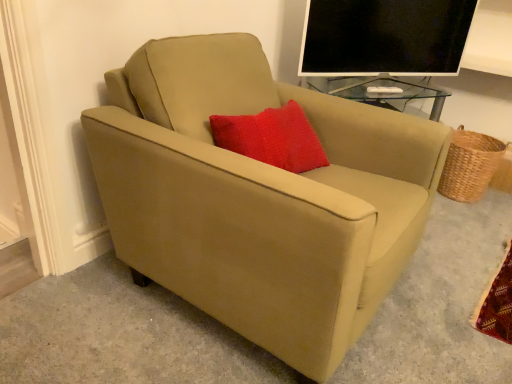
Question: Considering the relative sizes of suede beige armchair at center and black glossy monitor at upper right in the image provided, is suede beige armchair at center bigger than black glossy monitor at upper right?

Choices:
 (A) no
 (B) yes

Answer: (B)

Question: Does suede beige armchair at center lie in front of black glossy monitor at upper right?

Choices:
 (A) yes
 (B) no

Answer: (A)

Question: Does suede beige armchair at center have a lesser width compared to black glossy monitor at upper right?

Choices:
 (A) no
 (B) yes

Answer: (A)

Question: Is suede beige armchair at center touching black glossy monitor at upper right?

Choices:
 (A) no
 (B) yes

Answer: (A)

Question: From the image's perspective, does suede beige armchair at center appear lower than black glossy monitor at upper right?

Choices:
 (A) no
 (B) yes

Answer: (B)

Question: Looking at their shapes, would you say woven brown basket at right is wider or thinner than black glossy monitor at upper right?

Choices:
 (A) wide
 (B) thin

Answer: (A)

Question: Is woven brown basket at right bigger or smaller than black glossy monitor at upper right?

Choices:
 (A) big
 (B) small

Answer: (B)

Question: From a real-world perspective, relative to black glossy monitor at upper right, is woven brown basket at right vertically above or below?

Choices:
 (A) above
 (B) below

Answer: (B)

Question: Does point (452, 153) appear closer or farther from the camera than point (316, 39)?

Choices:
 (A) farther
 (B) closer

Answer: (A)

Question: Is point pyautogui.click(x=408, y=216) positioned closer to the camera than point pyautogui.click(x=446, y=11)?

Choices:
 (A) farther
 (B) closer

Answer: (B)

Question: Is suede beige armchair at center to the left or to the right of black glossy monitor at upper right in the image?

Choices:
 (A) left
 (B) right

Answer: (A)

Question: In terms of size, does suede beige armchair at center appear bigger or smaller than black glossy monitor at upper right?

Choices:
 (A) big
 (B) small

Answer: (A)

Question: From a real-world perspective, is suede beige armchair at center positioned above or below black glossy monitor at upper right?

Choices:
 (A) above
 (B) below

Answer: (B)

Question: Is suede beige armchair at center taller or shorter than woven brown basket at right?

Choices:
 (A) short
 (B) tall

Answer: (B)

Question: From the image's perspective, is suede beige armchair at center positioned above or below woven brown basket at right?

Choices:
 (A) below
 (B) above

Answer: (A)